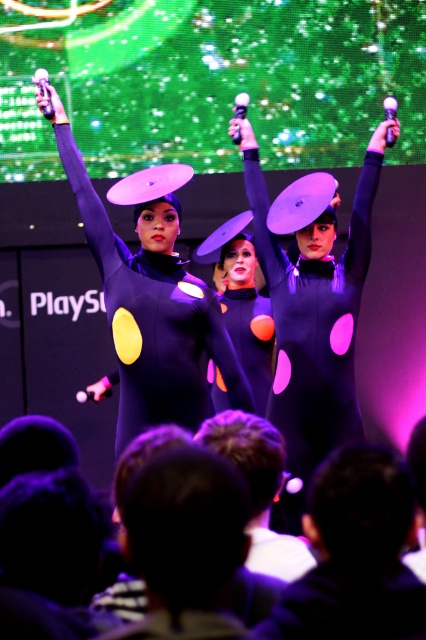
You are a photographer at the back of the stage. You want to capture a closeup of the black hair at lower center located at point (186, 544). What is the position of the black hair at lower center relative to the center of the stage?

The black hair at lower center is positioned at point (186, 544), which is slightly to the right and just below the center of the stage.

You are sitting in the front row of the audience watching the performance. You notice two points on the stage marked as point 1 at coordinates (331, 596) and point 2 at (160, 582). Which point is closer to you?

Point 1 at coordinates (331, 596) is closer to you because it is further to the viewer than point 2 at (160, 582).